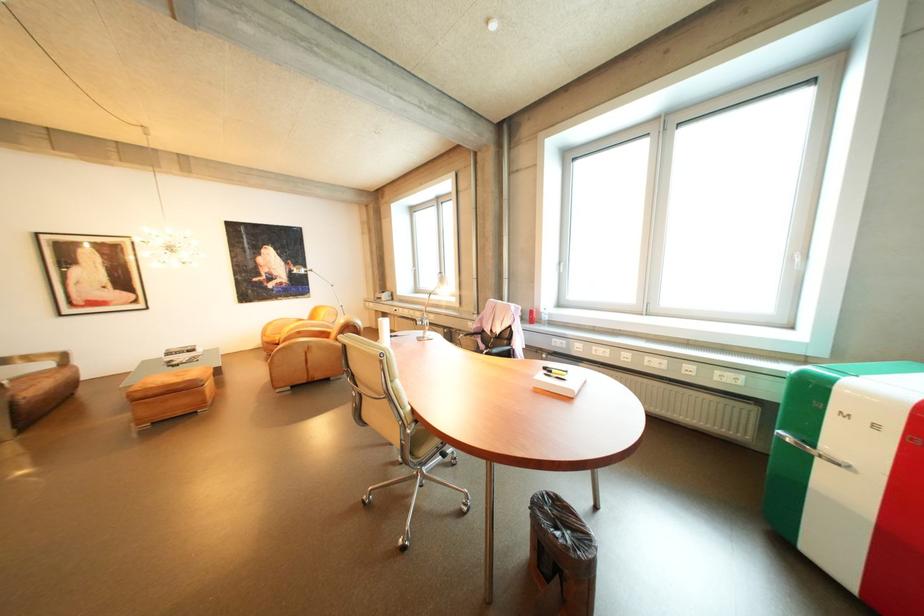
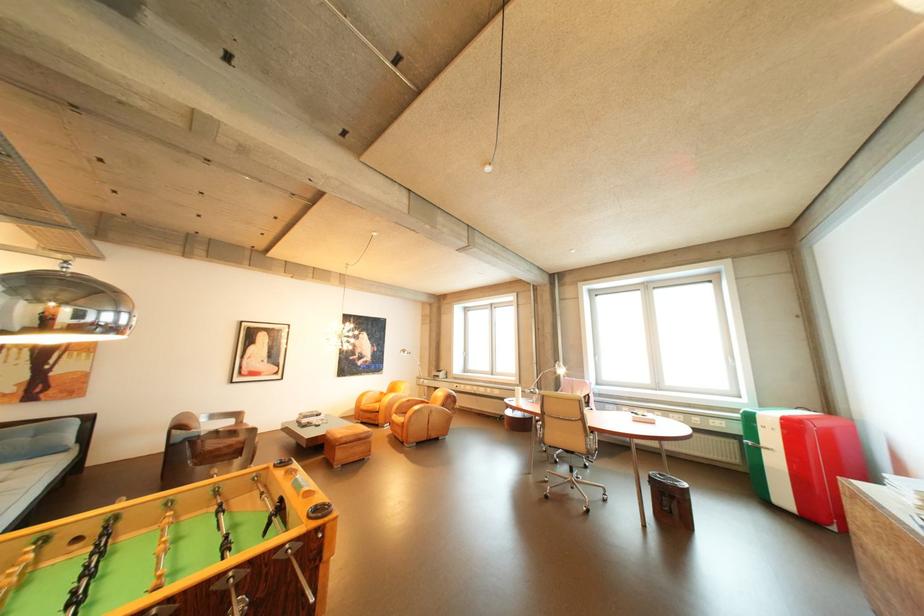
Where in the second image is the point corresponding to (x=767, y=410) from the first image?

(748, 443)